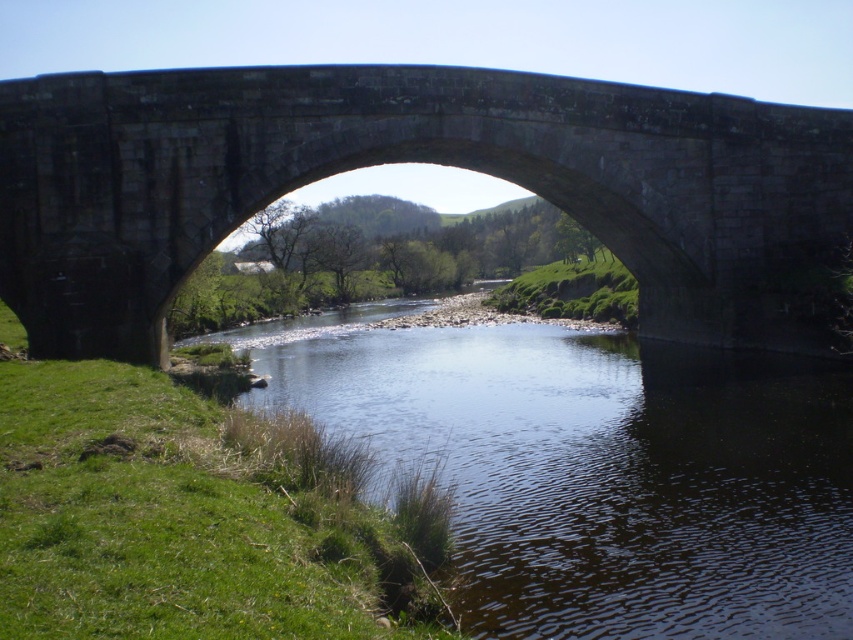
Question: Does dark gray stone bridge at center appear on the right side of clear water at center?

Choices:
 (A) yes
 (B) no

Answer: (B)

Question: From the image, what is the correct spatial relationship of dark gray stone bridge at center in relation to clear water at center?

Choices:
 (A) left
 (B) right

Answer: (A)

Question: Is dark gray stone bridge at center to the left of clear water at center from the viewer's perspective?

Choices:
 (A) yes
 (B) no

Answer: (A)

Question: Which object appears farthest from the camera in this image?

Choices:
 (A) clear water at center
 (B) dark gray stone bridge at center

Answer: (B)

Question: Among these points, which one is nearest to the camera?

Choices:
 (A) (631, 420)
 (B) (769, 296)

Answer: (A)

Question: Which object appears closest to the camera in this image?

Choices:
 (A) clear water at center
 (B) dark gray stone bridge at center

Answer: (A)